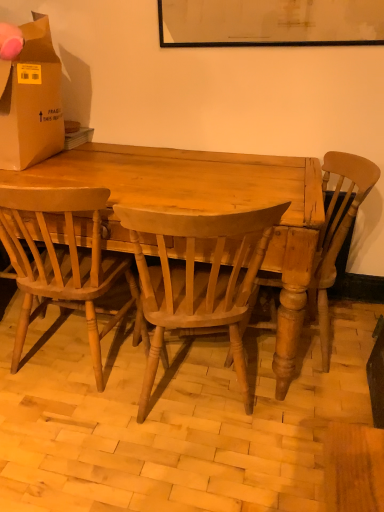
This screenshot has width=384, height=512. What are the coordinates of `vacant space to the right of brown cardboard box at upper left` in the screenshot? It's located at (137, 158).